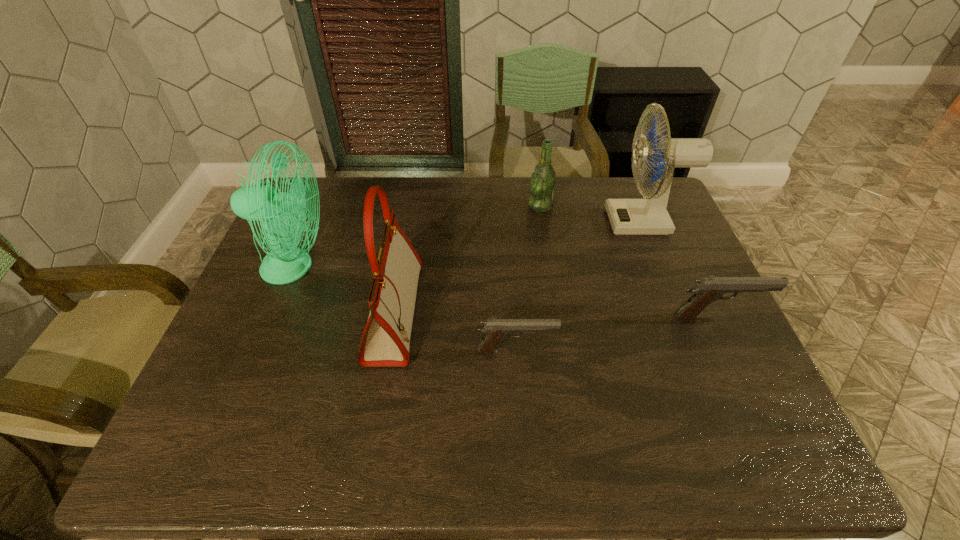
Locate an element on the screen. The width and height of the screenshot is (960, 540). pistol that is at the right edge is located at coordinates (707, 289).

Where is `fan present at the right edge`? Image resolution: width=960 pixels, height=540 pixels. fan present at the right edge is located at coordinates click(649, 216).

At what (x,y) coordinates should I click in order to perform the action: click on object present at the far right corner. Please return your answer as a coordinate pair (x, y). The height and width of the screenshot is (540, 960). Looking at the image, I should click on (649, 216).

I want to click on free space at the far edge of the desktop, so click(x=563, y=183).

At what (x,y) coordinates should I click in order to perform the action: click on free space at the left edge. Please return your answer as a coordinate pair (x, y). The height and width of the screenshot is (540, 960). Looking at the image, I should click on (249, 293).

The image size is (960, 540). What are the coordinates of `free space at the right edge of the desktop` in the screenshot? It's located at (738, 359).

Find the location of a particular element. This screenshot has height=540, width=960. vacant area between the handbag and the fourth tallest object is located at coordinates (468, 259).

I want to click on vacant space in between the left fan and the fifth tallest object, so click(x=506, y=292).

The width and height of the screenshot is (960, 540). Identify the location of vacant area that lies between the right fan and the third shortest object. pyautogui.click(x=592, y=214).

Where is `unoccupied position between the beer bottle and the leftmost object`? unoccupied position between the beer bottle and the leftmost object is located at coordinates (418, 237).